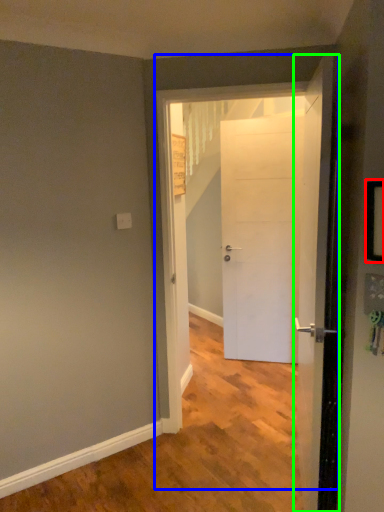
Question: Based on their relative distances, which object is nearer to picture frame (highlighted by a red box)? Choose from door (highlighted by a blue box) and door (highlighted by a green box).

Choices:
 (A) door
 (B) door

Answer: (B)